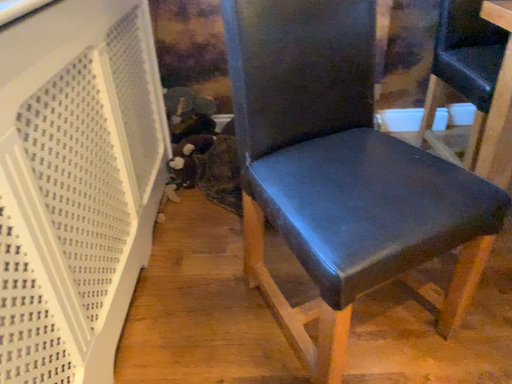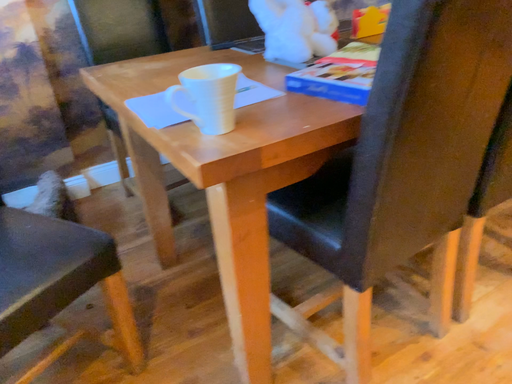
Question: How did the camera likely rotate when shooting the video?

Choices:
 (A) rotated right
 (B) rotated left

Answer: (A)